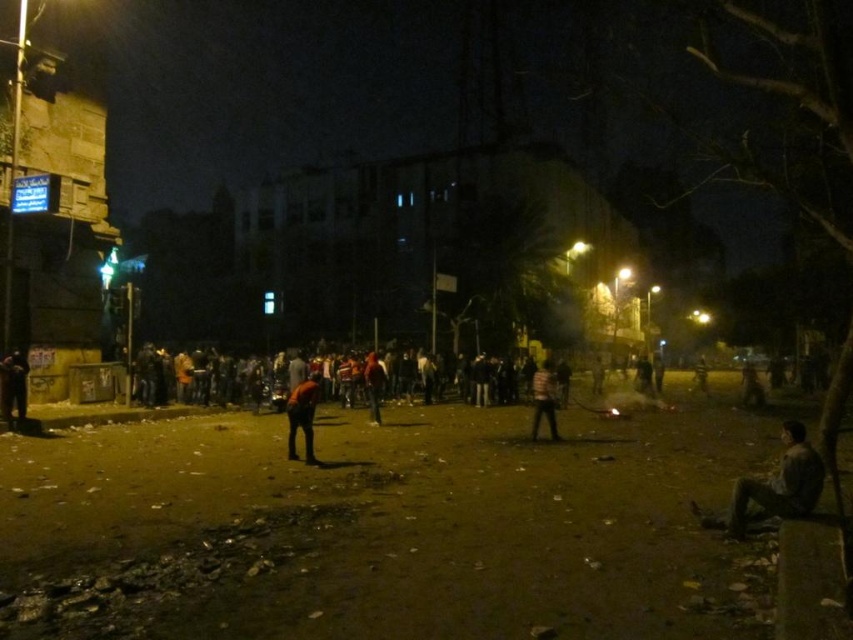
Between striped shirt at center and orange fabric shirt at center, which one is positioned higher?

orange fabric shirt at center is higher up.

This screenshot has width=853, height=640. Find the location of `striped shirt at center`. striped shirt at center is located at coordinates [x=544, y=400].

The image size is (853, 640). Find the location of `striped shirt at center`. striped shirt at center is located at coordinates (544, 400).

From the picture: Measure the distance between camouflage fabric person at lower right and dark clothing figure at left.

A distance of 44.79 feet exists between camouflage fabric person at lower right and dark clothing figure at left.

Does point (763, 477) lie in front of point (10, 364)?

Yes.

Between point (693, 502) and point (4, 392), which one is positioned behind?

The point (4, 392) is behind.

Where is `camouflage fabric person at lower right`? Image resolution: width=853 pixels, height=640 pixels. camouflage fabric person at lower right is located at coordinates (775, 486).

Is point (294, 408) farther from viewer compared to point (369, 371)?

No, it is not.

Is point (293, 445) less distant than point (364, 388)?

That is True.

The width and height of the screenshot is (853, 640). In order to click on dark brown leather jacket at center in this screenshot , I will do (x=302, y=416).